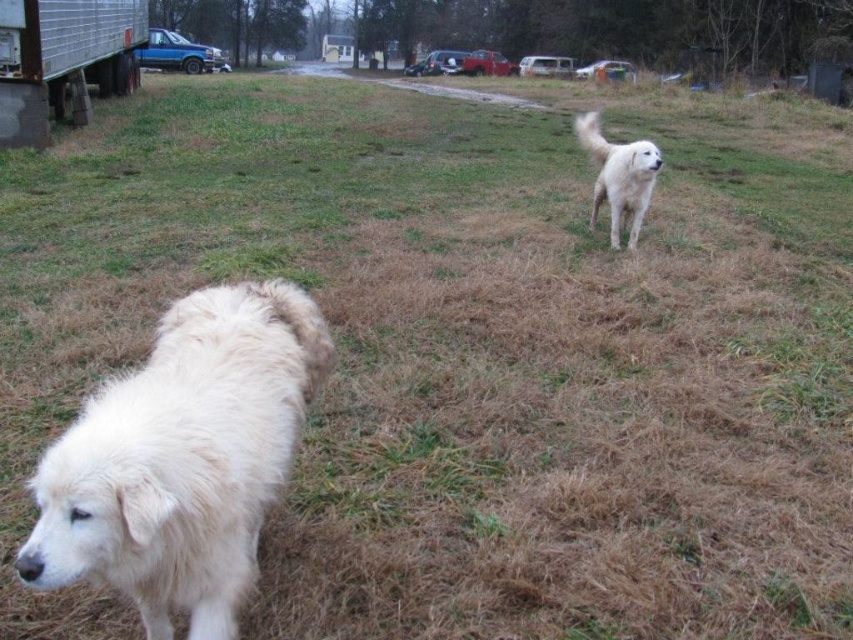
You are standing in the rural outdoor scene with two large white dogs. You notice two points marked in the image. The first point is at coordinates point (177, 472) and the second is at point (643, 161). Which point is closer to your current position?

Point (177, 472) is closer to the camera than point (643, 161), so the first point is closer to your current position.

You are a photographer trying to capture both dogs in a single frame. Given their sizes in the image, which dog, the white fluffy dog at lower left or the white fluffy dog at upper right, would appear smaller in the photo?

The white fluffy dog at lower left appears smaller in the photo because it occupies less space compared to the white fluffy dog at upper right.